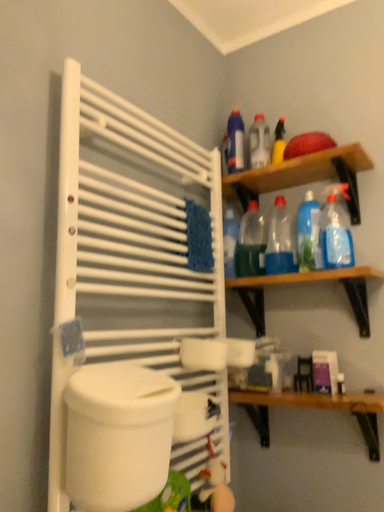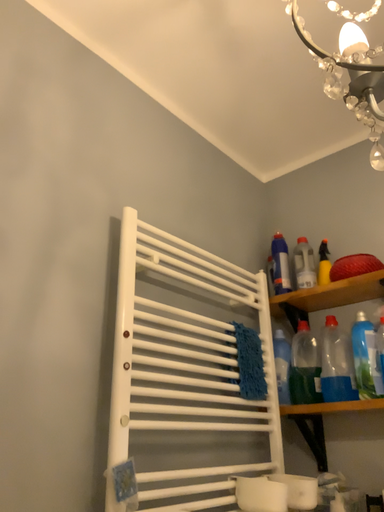
Question: Which way did the camera rotate in the video?

Choices:
 (A) rotated upward
 (B) rotated downward

Answer: (A)